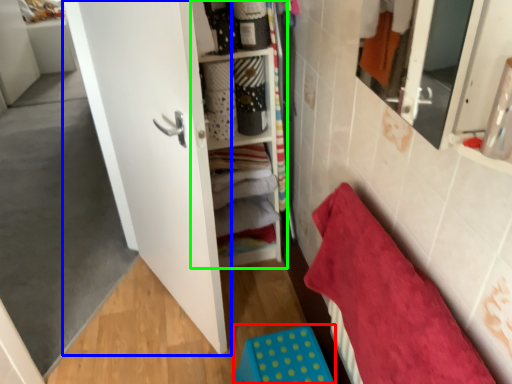
Question: Based on their relative distances, which object is nearer to step stool (highlighted by a red box)? Choose from door (highlighted by a blue box) and cabinet (highlighted by a green box).

Choices:
 (A) door
 (B) cabinet

Answer: (A)